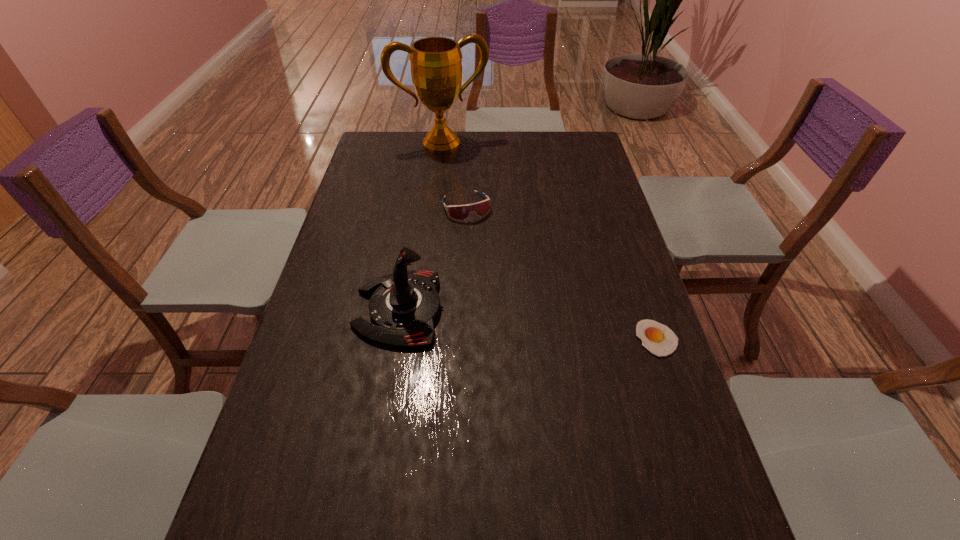
At what (x,y) coordinates should I click in order to perform the action: click on joystick. Please return your answer as a coordinate pair (x, y). This screenshot has height=540, width=960. Looking at the image, I should click on (404, 305).

Locate an element on the screen. This screenshot has width=960, height=540. egg yolk is located at coordinates (658, 339).

Where is `the rightmost object`? the rightmost object is located at coordinates (658, 339).

At what (x,y) coordinates should I click in order to perform the action: click on award. Please return your answer as a coordinate pair (x, y). This screenshot has height=540, width=960. Looking at the image, I should click on (436, 67).

I want to click on the farthest object, so click(x=436, y=67).

Locate an element on the screen. Image resolution: width=960 pixels, height=540 pixels. the second farthest object is located at coordinates (479, 209).

Image resolution: width=960 pixels, height=540 pixels. In order to click on goggles in this screenshot , I will do `click(479, 209)`.

Find the location of a particular element. vacant space located 0.070m on the handle side of the joystick is located at coordinates (328, 309).

In order to click on vacant space located 0.110m on the front of the egg yolk in this screenshot , I will do pyautogui.click(x=678, y=400).

Find the location of a particular element. free space located 0.290m on the front-facing side of the tallest object is located at coordinates (473, 199).